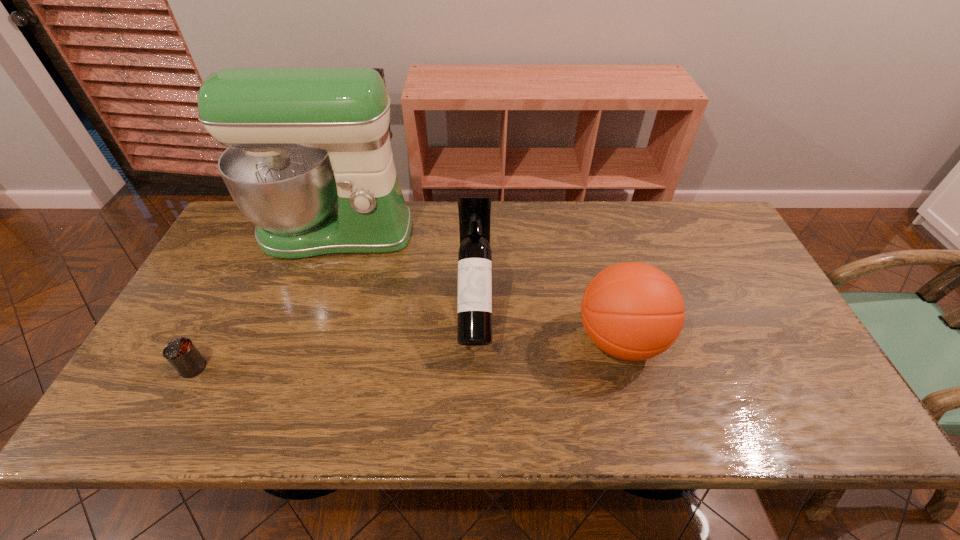
What are the coordinates of `the tallest object` in the screenshot? It's located at (309, 161).

Locate an element on the screen. the farthest object is located at coordinates (309, 161).

Where is `the second tallest object`? This screenshot has height=540, width=960. the second tallest object is located at coordinates (474, 311).

Locate an element on the screen. This screenshot has height=540, width=960. the third object from left to right is located at coordinates (474, 311).

The height and width of the screenshot is (540, 960). Find the location of `the second shortest object`. the second shortest object is located at coordinates (633, 311).

Find the location of a particular element. This screenshot has height=540, width=960. the rightmost object is located at coordinates (633, 311).

You are a GUI agent. You are given a task and a screenshot of the screen. Output one action in this format:
    pyautogui.click(x=<x>, y=<y>)
    Task: Click on the shortest object
    This screenshot has height=540, width=960.
    Given the screenshot: What is the action you would take?
    pyautogui.click(x=181, y=353)

Find the location of a particular element. The image size is (960, 540). free space located 0.130m on the controls of the mixer is located at coordinates (311, 296).

Image resolution: width=960 pixels, height=540 pixels. I want to click on free spot located on the stand of the wine bottle, so click(x=474, y=402).

Locate an element on the screen. free region located 0.190m on the back of the rightmost object is located at coordinates (598, 257).